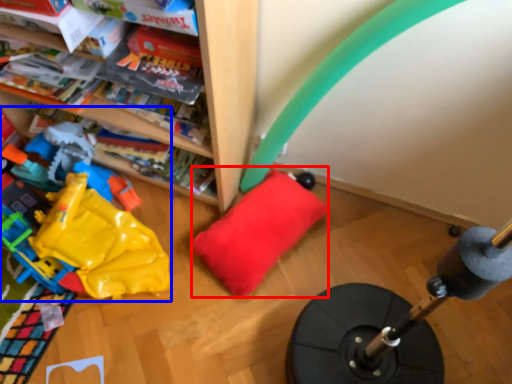
Question: Among these objects, which one is nearest to the camera, pillow (highlighted by a red box) or toy (highlighted by a blue box)?

Choices:
 (A) pillow
 (B) toy

Answer: (B)